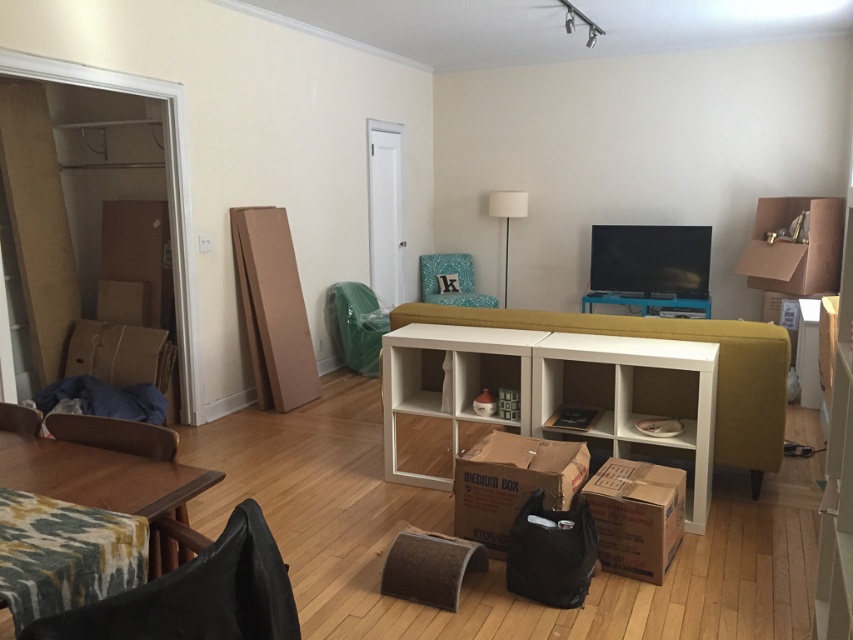
Can you confirm if brown cardboard box at center is taller than teal fabric armchair at center?

In fact, brown cardboard box at center may be shorter than teal fabric armchair at center.

Which is in front, point (463, 497) or point (428, 260)?

Positioned in front is point (463, 497).

The width and height of the screenshot is (853, 640). Identify the location of brown cardboard box at center. (512, 483).

Is brown cardboard box at upper right bigger than wooden armchair at lower left?

Yes.

Is point (762, 282) behind point (158, 573)?

Yes, it is behind point (158, 573).

Identify the location of brown cardboard box at upper right. (795, 246).

Is the position of wooden table at lower left less distant than that of green fabric armchair at center?

Yes, it is.

Between wooden table at lower left and green fabric armchair at center, which one appears on the left side from the viewer's perspective?

Positioned to the left is wooden table at lower left.

At what (x,y) coordinates should I click in order to perform the action: click on wooden table at lower left. Please return your answer as a coordinate pair (x, y). Image resolution: width=853 pixels, height=640 pixels. Looking at the image, I should click on (99, 476).